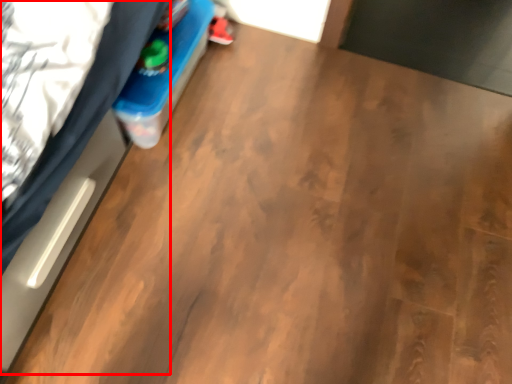
Question: From the image, what is the correct spatial relationship of bed (annotated by the red box) in relation to footwear?

Choices:
 (A) left
 (B) right

Answer: (A)